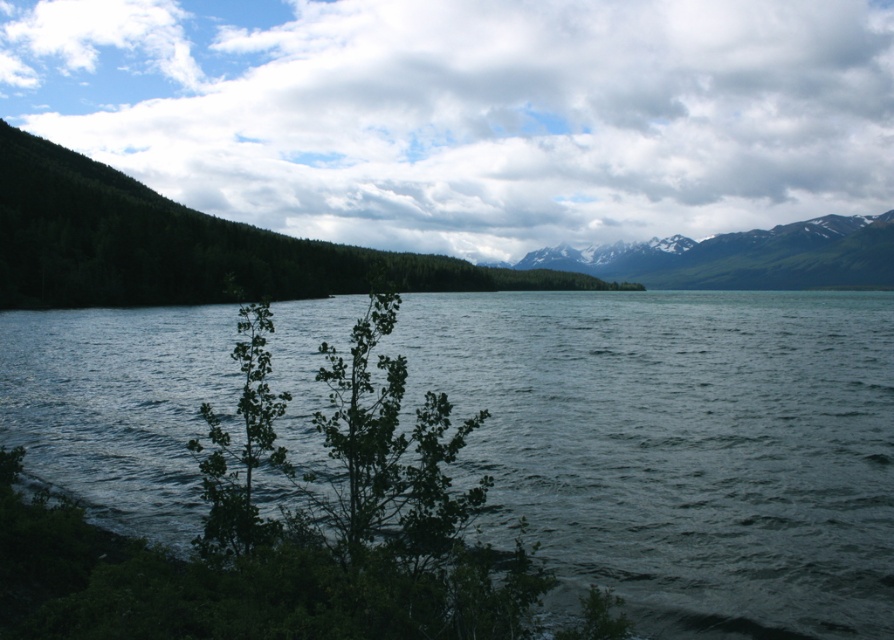
You are an artist trying to paint this scene. You want to ensure the white fluffy cloud at upper center and the green leafy tree at left are proportionally accurate. Which object should you draw larger?

The white fluffy cloud at upper center should be drawn larger than the green leafy tree at left because it is bigger according to the description.

You are standing at the point with coordinates point (505, 276) and want to walk towards the point with coordinates point (794, 211). Will the small trees and shrubs in the foreground block your path?

Point (794, 211) is behind point (505, 276), so the small trees and shrubs in the foreground will block your path.